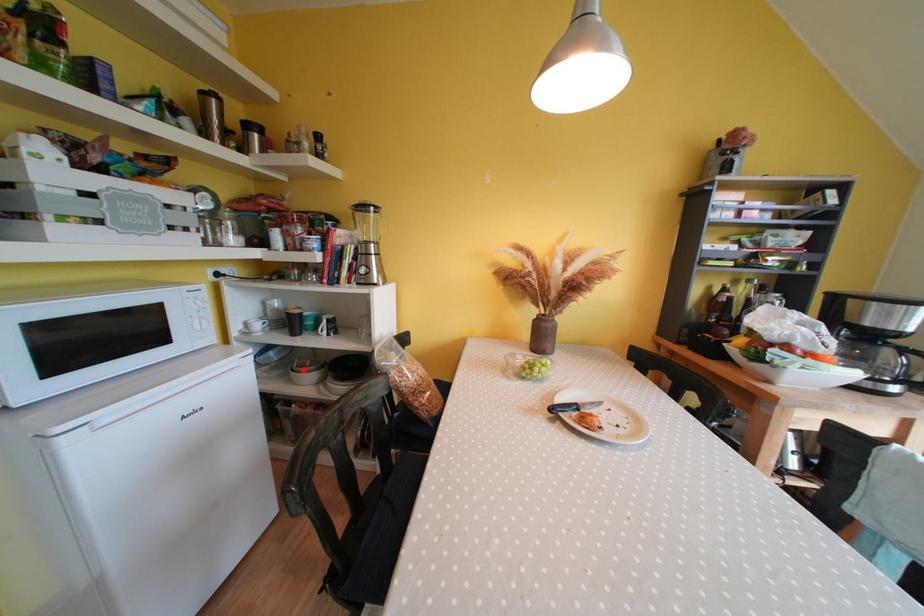
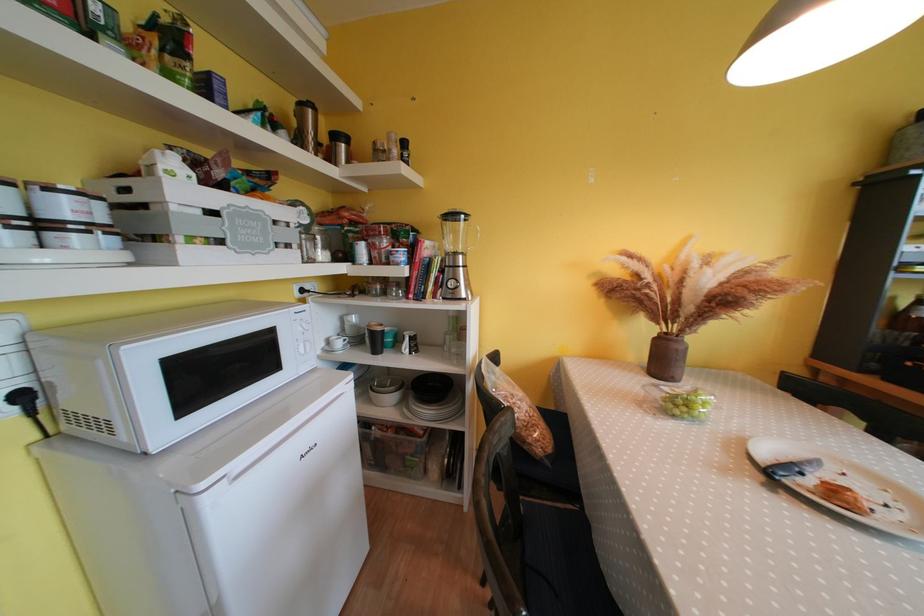
Question: I am providing you with two images of the same scene from different viewpoints. A red point is marked on the first image. At the location where the point appears in image 1, is it still visible in image 2?

Choices:
 (A) Yes
 (B) No

Answer: (A)